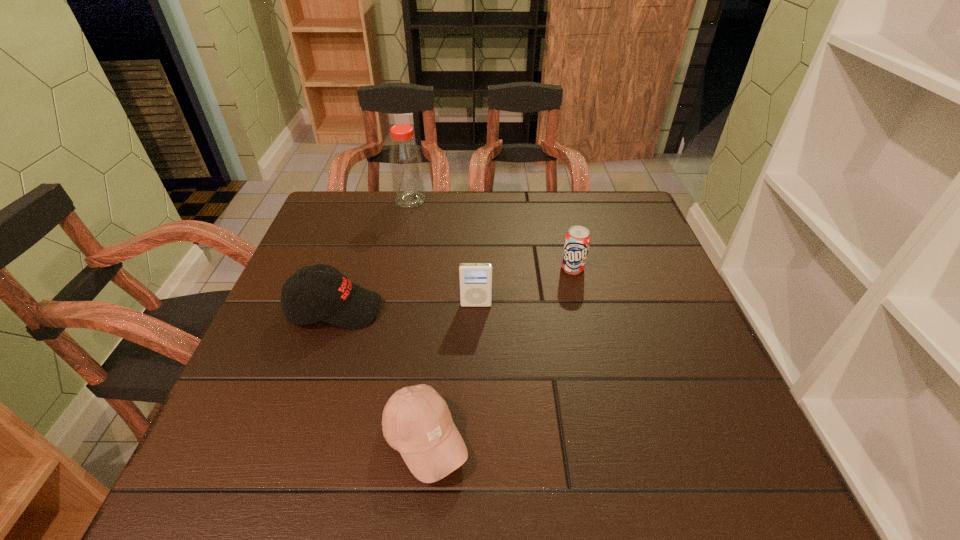
At what (x,y) coordinates should I click in order to perform the action: click on bottle. Please return your answer as a coordinate pair (x, y). Image resolution: width=960 pixels, height=540 pixels. Looking at the image, I should click on (405, 161).

Locate an element on the screen. the farthest object is located at coordinates (405, 161).

At what (x,y) coordinates should I click in order to perform the action: click on iPod. Please return your answer as a coordinate pair (x, y). The image size is (960, 540). Looking at the image, I should click on (475, 278).

At what (x,y) coordinates should I click in order to perform the action: click on the second farthest object. Please return your answer as a coordinate pair (x, y). Looking at the image, I should click on (577, 240).

This screenshot has height=540, width=960. In order to click on the rightmost object in this screenshot , I will do tap(577, 240).

At what (x,y) coordinates should I click in order to perform the action: click on the farther baseball cap. Please return your answer as a coordinate pair (x, y). Looking at the image, I should click on (341, 303).

Locate an element on the screen. The image size is (960, 540). the taller baseball cap is located at coordinates (341, 303).

You are a GUI agent. You are given a task and a screenshot of the screen. Output one action in this format:
    pyautogui.click(x=<x>, y=<y>)
    Task: Click on the right baseball cap
    Image resolution: width=960 pixels, height=540 pixels.
    Given the screenshot: What is the action you would take?
    pyautogui.click(x=416, y=421)

Find the location of `the shorter baseball cap`. the shorter baseball cap is located at coordinates (416, 421).

Identify the location of vacant space situated 0.130m on the right of the bottle. (468, 200).